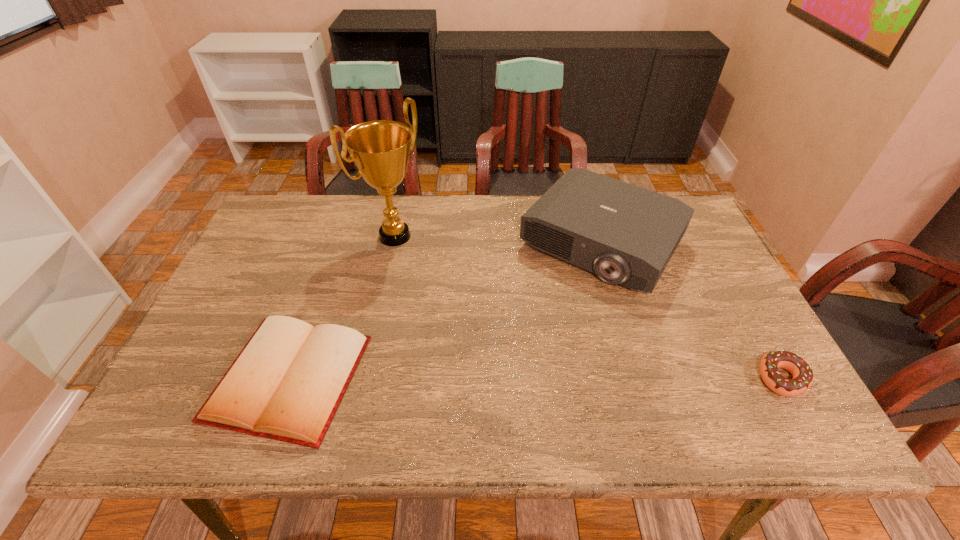
Identify the location of Bible. (286, 384).

Where is `doughnut`? doughnut is located at coordinates (802, 373).

Locate an element on the screen. The height and width of the screenshot is (540, 960). award is located at coordinates (380, 149).

At what (x,y) coordinates should I click in order to perform the action: click on the third shortest object. Please return your answer as a coordinate pair (x, y). The height and width of the screenshot is (540, 960). Looking at the image, I should click on (626, 234).

I want to click on projector, so click(626, 234).

Where is `vacant space located 0.370m on the right of the Bible`? vacant space located 0.370m on the right of the Bible is located at coordinates (527, 378).

The image size is (960, 540). Find the location of `free region located on the back of the doughnut`. free region located on the back of the doughnut is located at coordinates (734, 293).

This screenshot has width=960, height=540. Find the location of `free location located on the front view with handles of the award`. free location located on the front view with handles of the award is located at coordinates pyautogui.click(x=430, y=262).

This screenshot has height=540, width=960. I want to click on free space located on the front view with handles of the award, so [x=464, y=287].

Image resolution: width=960 pixels, height=540 pixels. Find the location of `vacant area situated 0.350m on the front view with handles of the award`. vacant area situated 0.350m on the front view with handles of the award is located at coordinates (501, 315).